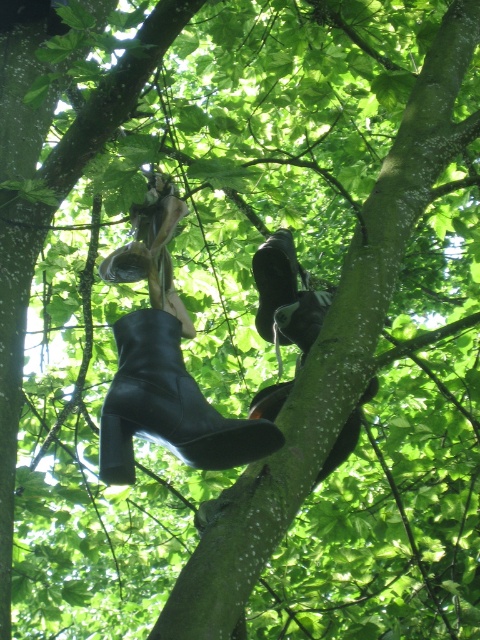
Question: Can you confirm if black leather boot at center is wider than black leather boot at upper center?

Choices:
 (A) yes
 (B) no

Answer: (A)

Question: Which of the following is the farthest from the observer?

Choices:
 (A) black leather boot at upper center
 (B) black leather boot at center

Answer: (A)

Question: Which of the following is the farthest from the observer?

Choices:
 (A) (252, 444)
 (B) (279, 257)

Answer: (B)

Question: Is black leather boot at center bigger than black leather boot at upper center?

Choices:
 (A) no
 (B) yes

Answer: (B)

Question: Does black leather boot at center lie behind black leather boot at upper center?

Choices:
 (A) no
 (B) yes

Answer: (A)

Question: Which object is farther from the camera taking this photo?

Choices:
 (A) black leather boot at upper center
 (B) black leather boot at center

Answer: (A)